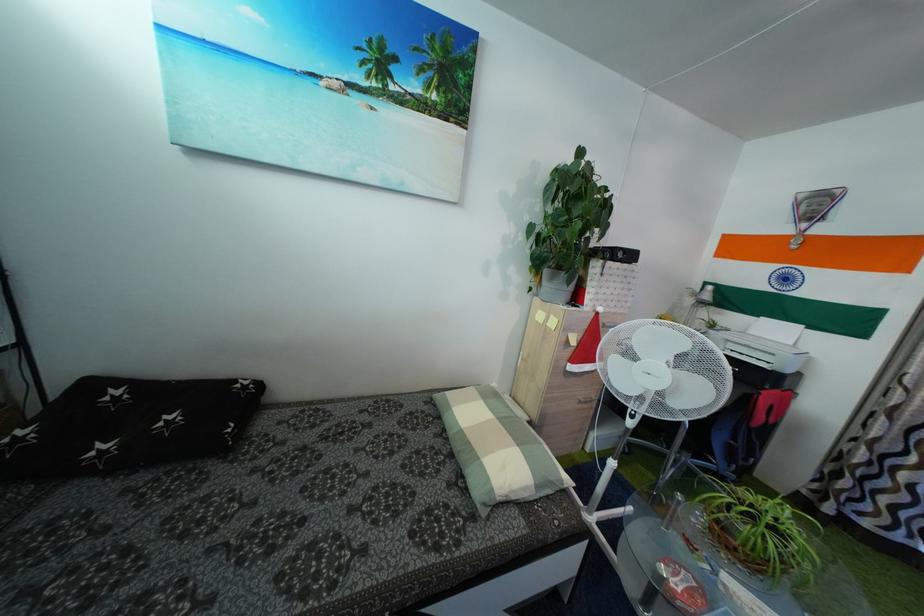
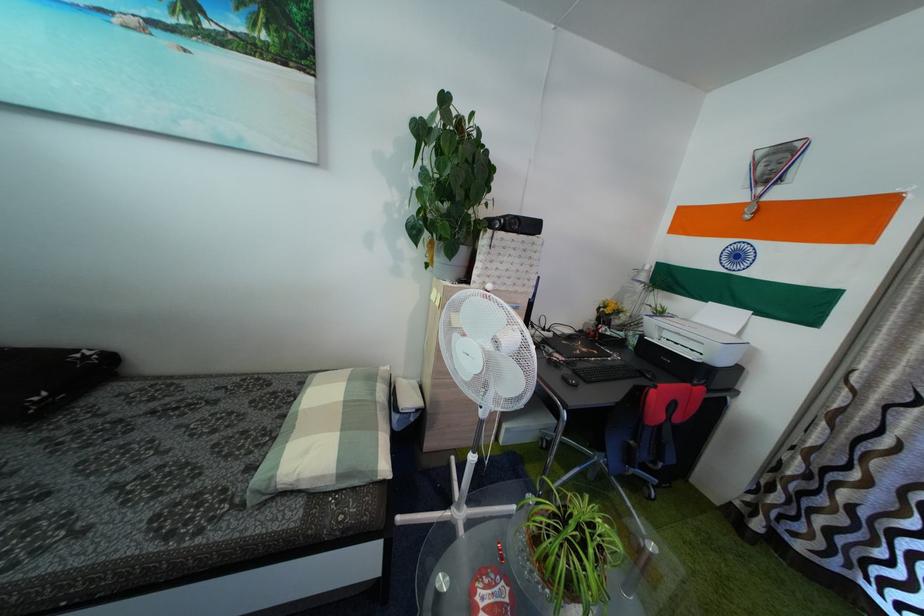
The point at (759, 339) is marked in the first image. Where is the corresponding point in the second image?

(703, 328)